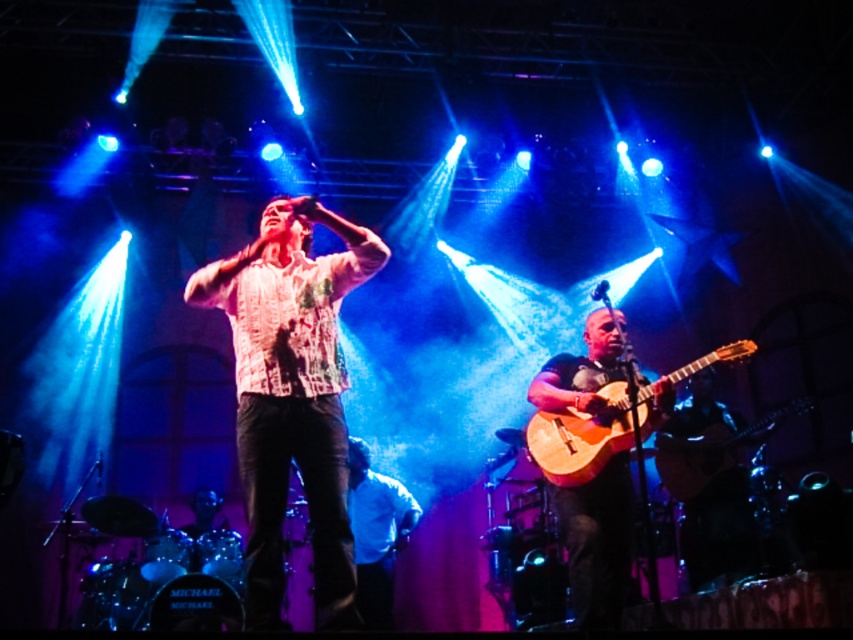
Find the location of a particular element. wooden acoustic guitar at lower right is located at coordinates (579, 436).

Can you confirm if wooden acoustic guitar at lower right is smaller than matte white shirt at center?

Correct, wooden acoustic guitar at lower right occupies less space than matte white shirt at center.

Is point (538, 454) farther from camera compared to point (398, 524)?

No, it is in front of (398, 524).

This screenshot has height=640, width=853. I want to click on wooden acoustic guitar at lower right, so click(579, 436).

Which is below, wooden acoustic guitar at center or wooden acoustic guitar at lower right?

wooden acoustic guitar at center is below.

Does wooden acoustic guitar at center have a smaller size compared to wooden acoustic guitar at lower right?

Incorrect, wooden acoustic guitar at center is not smaller in size than wooden acoustic guitar at lower right.

I want to click on wooden acoustic guitar at center, so click(x=596, y=541).

At what (x,y) coordinates should I click in order to perform the action: click on wooden acoustic guitar at center. Please return your answer as a coordinate pair (x, y). The image size is (853, 640). Looking at the image, I should click on (596, 541).

Can you confirm if wooden acoustic guitar at center is bigger than matte white shirt at center?

Indeed, wooden acoustic guitar at center has a larger size compared to matte white shirt at center.

Is wooden acoustic guitar at center behind matte white shirt at center?

No, it is in front of matte white shirt at center.

What do you see at coordinates (596, 541) in the screenshot?
I see `wooden acoustic guitar at center` at bounding box center [596, 541].

The width and height of the screenshot is (853, 640). I want to click on wooden acoustic guitar at center, so click(596, 541).